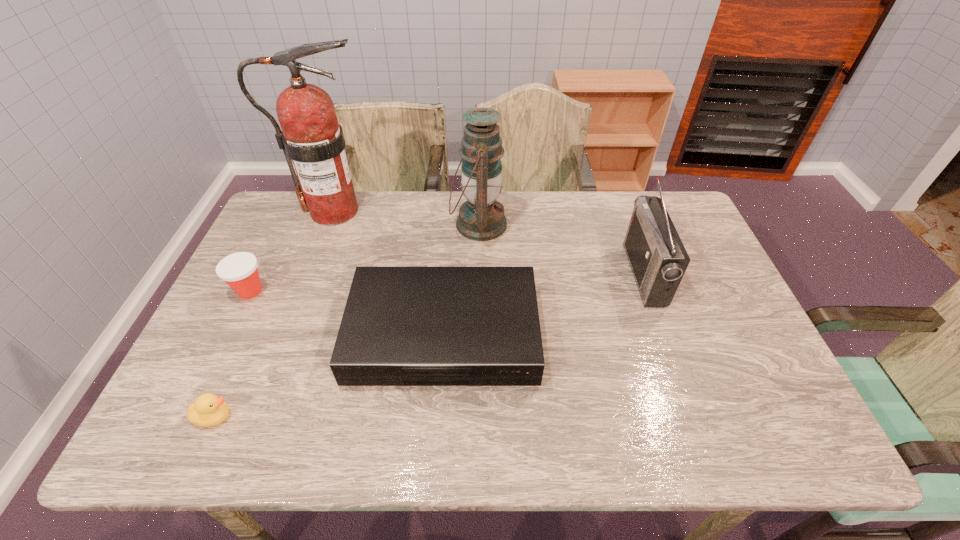
Find the location of a particular element. The width and height of the screenshot is (960, 540). vacant space situated on the front-facing side of the third tallest object is located at coordinates (553, 274).

Where is `vacant space located on the front-facing side of the third tallest object`? The image size is (960, 540). vacant space located on the front-facing side of the third tallest object is located at coordinates (536, 274).

Find the location of a particular element. free region located 0.260m on the front-facing side of the third tallest object is located at coordinates (542, 274).

What are the coordinates of `free location located 0.340m on the back of the Dixie cup` in the screenshot? It's located at (292, 207).

Find the location of a particular element. The height and width of the screenshot is (540, 960). free spot located at the front of the CD player for disc insertion is located at coordinates (438, 421).

Find the location of a particular element. This screenshot has width=960, height=540. free spot located 0.330m on the face of the nearest object is located at coordinates (382, 416).

This screenshot has height=540, width=960. Find the location of `fire extinguisher present at the far edge`. fire extinguisher present at the far edge is located at coordinates (311, 136).

Image resolution: width=960 pixels, height=540 pixels. Find the location of `oil lamp that is at the far edge`. oil lamp that is at the far edge is located at coordinates (481, 218).

The height and width of the screenshot is (540, 960). I want to click on object positioned at the near edge, so click(x=208, y=410).

Where is `fire extinguisher that is positioned at the left edge`? fire extinguisher that is positioned at the left edge is located at coordinates (311, 136).